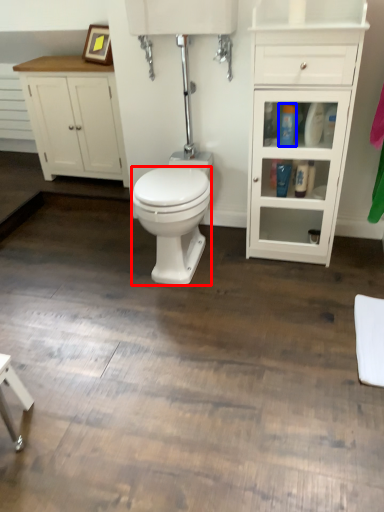
Question: Among these objects, which one is nearest to the camera, bidet (highlighted by a red box) or toiletry (highlighted by a blue box)?

Choices:
 (A) bidet
 (B) toiletry

Answer: (A)